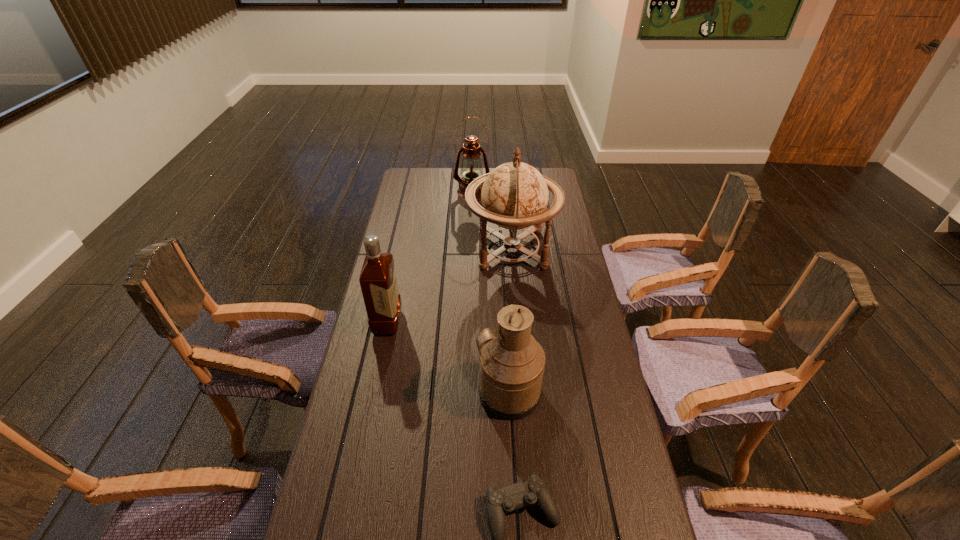
Find the location of a particular element. This screenshot has width=960, height=540. blank area located 0.070m on the front label of the third nearest object is located at coordinates (421, 322).

You are a GUI agent. You are given a task and a screenshot of the screen. Output one action in this format:
    pyautogui.click(x=<x>, y=<y>)
    Task: Click on the free space located on the back of the pitcher
    
    Given the screenshot: What is the action you would take?
    pyautogui.click(x=503, y=302)

Identify the location of object that is at the far edge. Image resolution: width=960 pixels, height=540 pixels. (471, 168).

The height and width of the screenshot is (540, 960). I want to click on object positioned at the left edge, so click(378, 281).

Find the location of `object that is positioned at the right edge`. object that is positioned at the right edge is located at coordinates (514, 196).

In order to click on vacant space at the far edge in this screenshot , I will do `click(485, 168)`.

Where is `free location at the left edge of the desktop`? free location at the left edge of the desktop is located at coordinates (401, 248).

The height and width of the screenshot is (540, 960). I want to click on vacant position at the right edge of the desktop, so click(598, 397).

Where is `vacant space at the far left corner of the desktop`? The image size is (960, 540). vacant space at the far left corner of the desktop is located at coordinates pos(433,180).

I want to click on free region at the far right corner, so click(x=547, y=174).